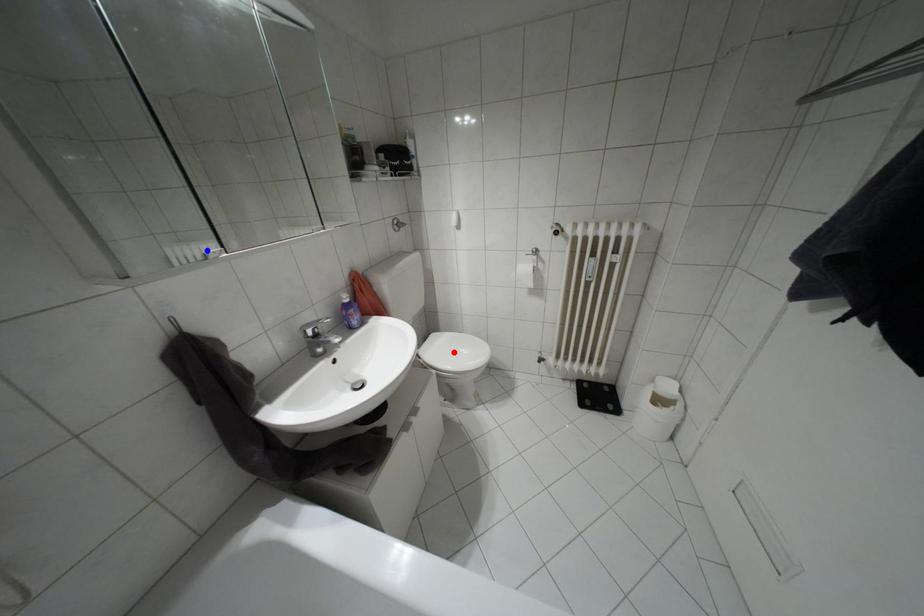
Question: Which of the two points in the image is closer to the camera?

Choices:
 (A) Blue point is closer.
 (B) Red point is closer.

Answer: (A)